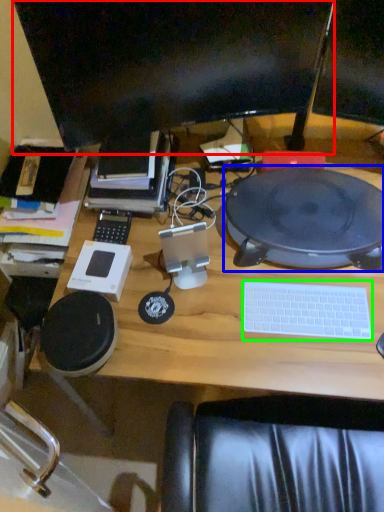
Question: Considering the real-world distances, which object is farthest from computer monitor (highlighted by a red box)? tablet computer (highlighted by a blue box) or computer keyboard (highlighted by a green box)?

Choices:
 (A) tablet computer
 (B) computer keyboard

Answer: (B)